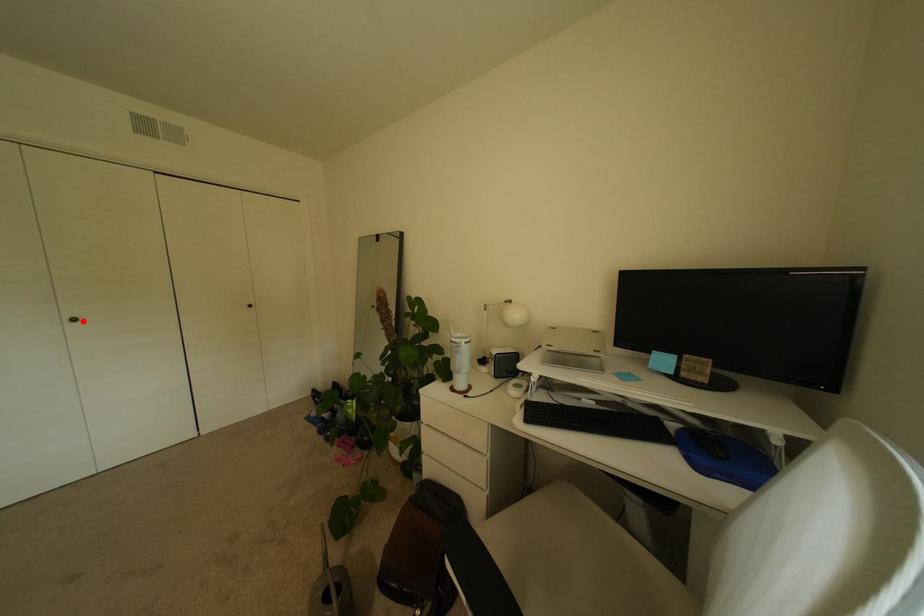
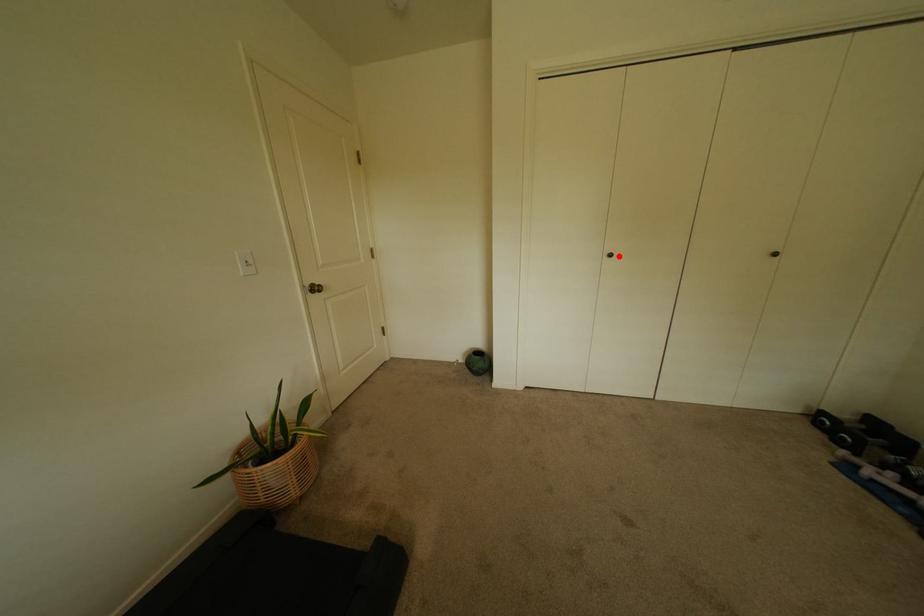
In the scene shown: I am providing you with two images of the same scene from different viewpoints. A red point is marked on the first image and another point is marked on the second image. Is the marked point in image1 the same physical position as the marked point in image2?

Yes